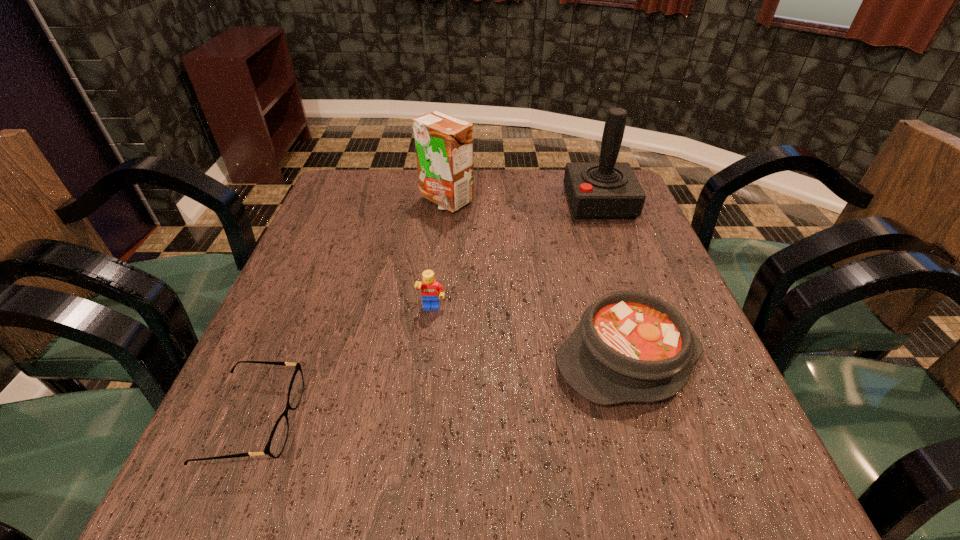
At what (x,y) coordinates should I click in order to perform the action: click on free point that satisfies the following two spatial constraints: 1. on the straw side of the carton; 2. on the front-facing side of the shortest object. Please return your answer as a coordinate pair (x, y). Looking at the image, I should click on (422, 421).

You are a GUI agent. You are given a task and a screenshot of the screen. Output one action in this format:
    pyautogui.click(x=<x>, y=<y>)
    Task: Click on the vacant space that satisfies the following two spatial constraints: 1. on the base of the joystick; 2. on the face of the Lego
    This screenshot has height=540, width=960.
    Given the screenshot: What is the action you would take?
    pyautogui.click(x=638, y=309)

What are the coordinates of `free spot that satisfies the following two spatial constraints: 1. on the face of the Lego; 2. on the front-facing side of the shortest object` in the screenshot? It's located at (420, 421).

Image resolution: width=960 pixels, height=540 pixels. In order to click on blank space that satisfies the following two spatial constraints: 1. on the base of the joystick; 2. on the front side of the casserole in this screenshot , I will do click(x=657, y=359).

At what (x,y) coordinates should I click in order to perform the action: click on vacant space that satisfies the following two spatial constraints: 1. on the face of the Lego; 2. on the front-facing side of the spectacles. Please return your answer as a coordinate pair (x, y). Looking at the image, I should click on (420, 421).